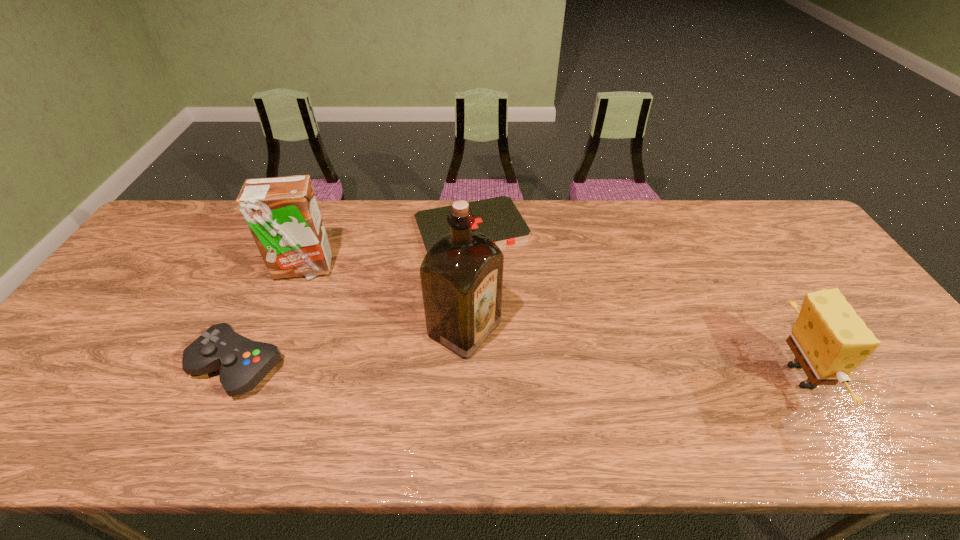
At what (x,y) coordinates should I click in order to perform the action: click on free region at the far edge. Please return your answer as a coordinate pair (x, y). The width and height of the screenshot is (960, 540). Looking at the image, I should click on (342, 200).

At what (x,y) coordinates should I click in order to perform the action: click on vacant region at the near edge. Please return your answer as a coordinate pair (x, y). Looking at the image, I should click on (317, 380).

The width and height of the screenshot is (960, 540). I want to click on free location at the left edge, so click(x=129, y=294).

The image size is (960, 540). I want to click on vacant region at the near left corner of the desktop, so (37, 397).

Locate an element on the screen. Image resolution: width=960 pixels, height=540 pixels. free region at the far right corner is located at coordinates (789, 225).

You are a GUI agent. You are given a task and a screenshot of the screen. Output one action in this format:
    pyautogui.click(x=<x>, y=<y>)
    Task: Click on the free space that is in between the second tallest object and the control
    This screenshot has height=540, width=960.
    Given the screenshot: What is the action you would take?
    pyautogui.click(x=271, y=317)

Locate an element on the screen. This screenshot has width=960, height=540. free space between the shortest object and the sponge is located at coordinates (635, 302).

This screenshot has width=960, height=540. I want to click on free space between the sponge and the shortest object, so click(x=635, y=302).

The width and height of the screenshot is (960, 540). What are the coordinates of `unoccupied position between the third tallest object and the control` in the screenshot? It's located at (518, 372).

What are the coordinates of `free space between the liquor and the third shortest object` in the screenshot? It's located at (632, 353).